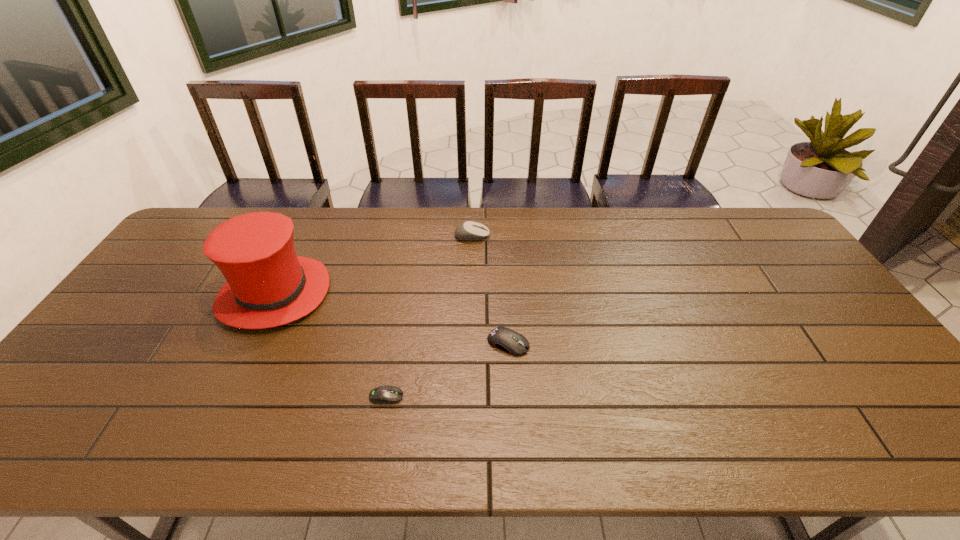
Find the location of `hat`. hat is located at coordinates (267, 285).

Locate an element on the screen. the tallest object is located at coordinates (267, 285).

Locate an element on the screen. The height and width of the screenshot is (540, 960). the farthest object is located at coordinates (467, 231).

The image size is (960, 540). Find the location of `the tallest computer mouse`. the tallest computer mouse is located at coordinates pyautogui.click(x=467, y=231).

Find the location of a particular element. This screenshot has width=960, height=540. the second nearest computer mouse is located at coordinates (508, 340).

This screenshot has width=960, height=540. What are the coordinates of `the second shortest computer mouse` in the screenshot? It's located at (508, 340).

Image resolution: width=960 pixels, height=540 pixels. In order to click on the shortest object in this screenshot , I will do `click(383, 394)`.

You are a GUI agent. You are given a task and a screenshot of the screen. Output one action in this format:
    pyautogui.click(x=<x>, y=<y>)
    Task: Click on the third object from right to left
    The height and width of the screenshot is (540, 960).
    Given the screenshot: What is the action you would take?
    pyautogui.click(x=383, y=394)

The image size is (960, 540). Find the location of `vacant space located on the back of the leftmost object`. vacant space located on the back of the leftmost object is located at coordinates (295, 251).

The image size is (960, 540). I want to click on free space located 0.340m on the wheel side of the tallest computer mouse, so click(588, 236).